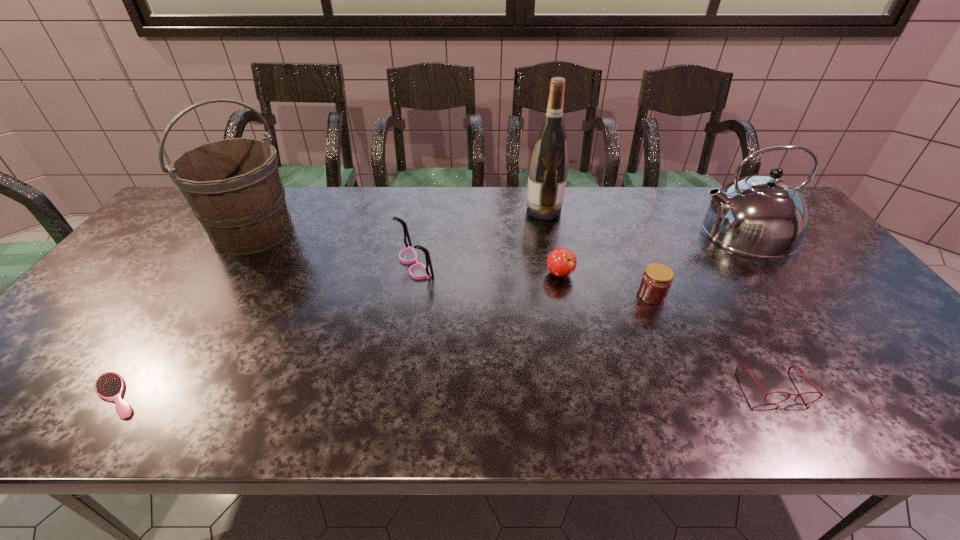
Locate an element on the screen. the shortest object is located at coordinates (110, 386).

Find the location of `vacant area situated 0.100m on the label of the wine bottle`. vacant area situated 0.100m on the label of the wine bottle is located at coordinates (495, 210).

You are a GUI agent. You are given a task and a screenshot of the screen. Output one action in this format:
    pyautogui.click(x=<x>, y=<y>)
    Task: Click on the free region located 0.050m on the label of the wine bottle
    The width and height of the screenshot is (960, 540).
    Given the screenshot: What is the action you would take?
    click(511, 210)

You are a GUI agent. You are given a task and a screenshot of the screen. Output one action in this format:
    pyautogui.click(x=<x>, y=<y>)
    Task: Click on the vacant point located on the label of the wine bottle
    The height and width of the screenshot is (540, 960).
    Given the screenshot: What is the action you would take?
    pyautogui.click(x=465, y=210)

This screenshot has width=960, height=540. Identify the location of free space located on the left of the bucket. (160, 231).

This screenshot has height=540, width=960. Identify the location of vacant space situated from the spout of the kettle. (662, 230).

Find the location of `free location located from the spout of the kettle`. free location located from the spout of the kettle is located at coordinates (627, 230).

Locate an element on the screen. blank space located 0.060m from the spout of the kettle is located at coordinates (675, 230).

You are a GUI agent. You are given a task and a screenshot of the screen. Output one action in this format:
    pyautogui.click(x=<x>, y=<y>)
    Task: Click on the vacant space located 0.250m on the front of the fifth shortest object
    The width and height of the screenshot is (960, 540).
    Given the screenshot: What is the action you would take?
    pyautogui.click(x=399, y=356)

Find the location of a particular element. This screenshot has width=960, height=540. free space located 0.310m on the front of the sixth object from left to right is located at coordinates (701, 415).